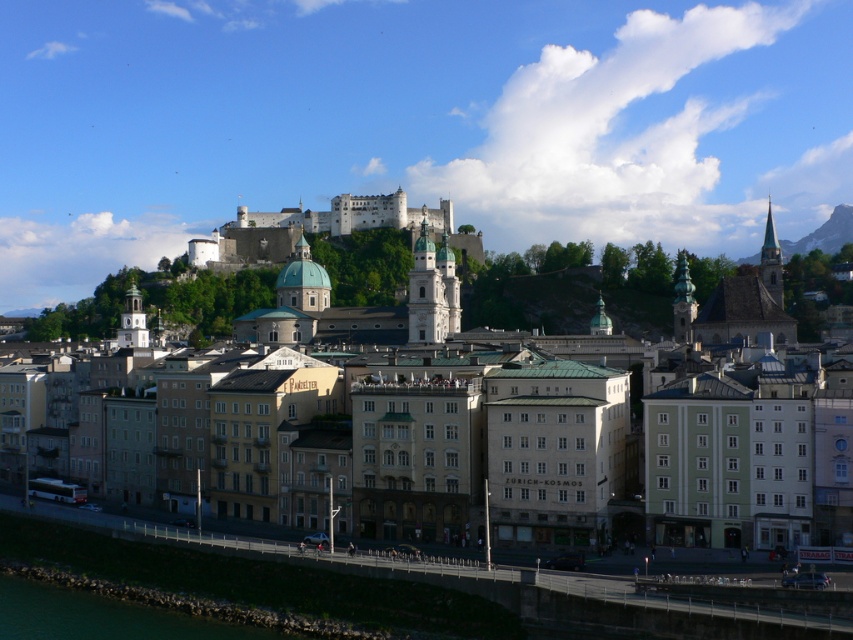
Question: Among these objects, which one is nearest to the camera?

Choices:
 (A) white stone castle at upper center
 (B) matte stone buildings at center
 (C) green stone wall at lower left

Answer: (C)

Question: Which point is farther from the camera taking this photo?

Choices:
 (A) (419, 256)
 (B) (125, 614)

Answer: (A)

Question: Does white stone castle at upper center appear on the right side of green stone wall at lower left?

Choices:
 (A) yes
 (B) no

Answer: (A)

Question: Is white stone castle at upper center positioned at the back of green stone wall at lower left?

Choices:
 (A) yes
 (B) no

Answer: (A)

Question: Is matte stone buildings at center bigger than green stone wall at lower left?

Choices:
 (A) no
 (B) yes

Answer: (B)

Question: Among these points, which one is nearest to the camera?

Choices:
 (A) (366, 225)
 (B) (10, 616)
 (C) (361, 524)

Answer: (B)